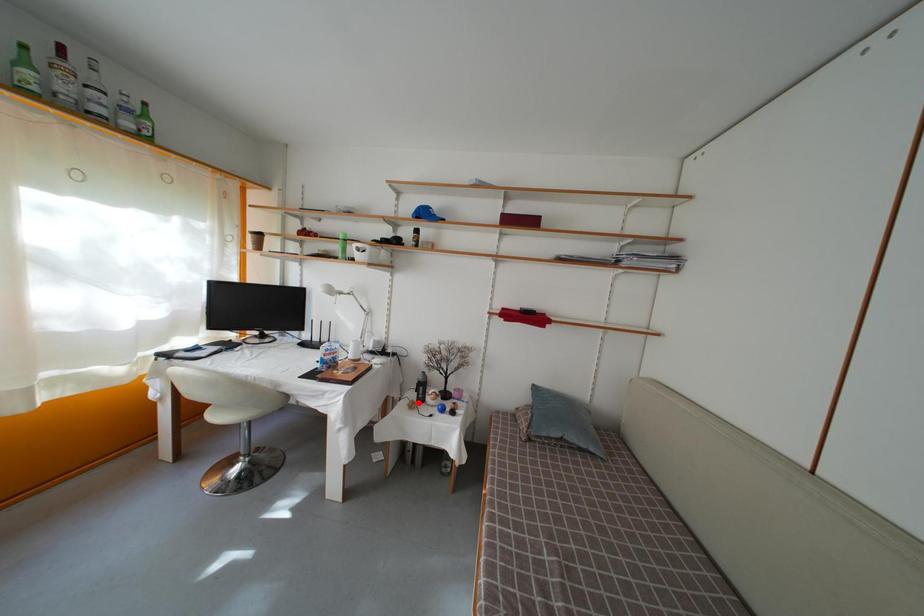
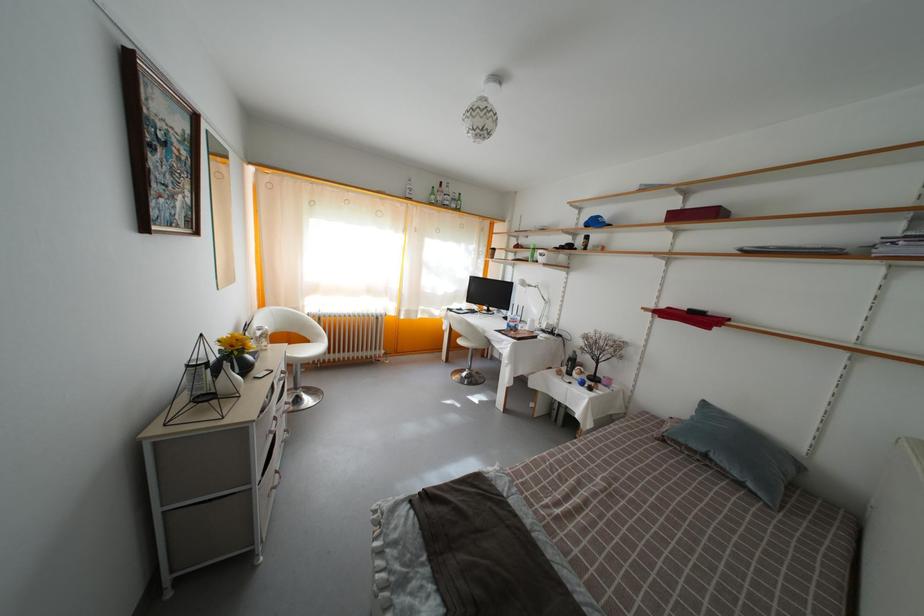
Question: I am providing you with two images of the same scene from different viewpoints. Given a red point in image1, look at the same physical point in image2. Is it:

Choices:
 (A) Closer to the viewpoint
 (B) Farther from the viewpoint

Answer: (A)